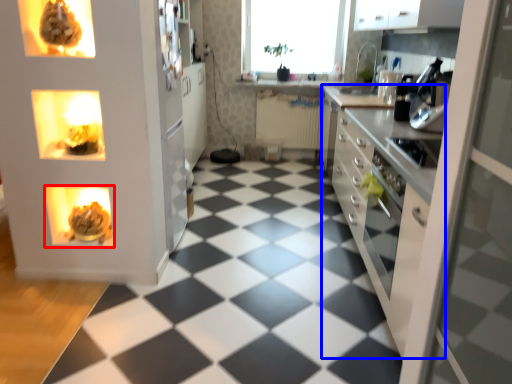
Question: Which of the following is the closest to the observer, appliance (highlighted by a red box) or countertop (highlighted by a blue box)?

Choices:
 (A) appliance
 (B) countertop

Answer: (B)